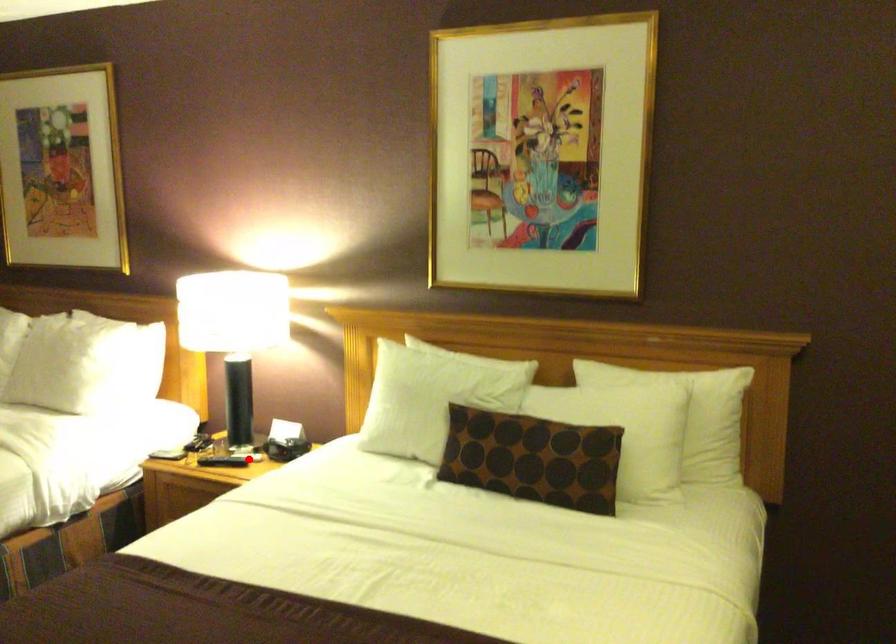
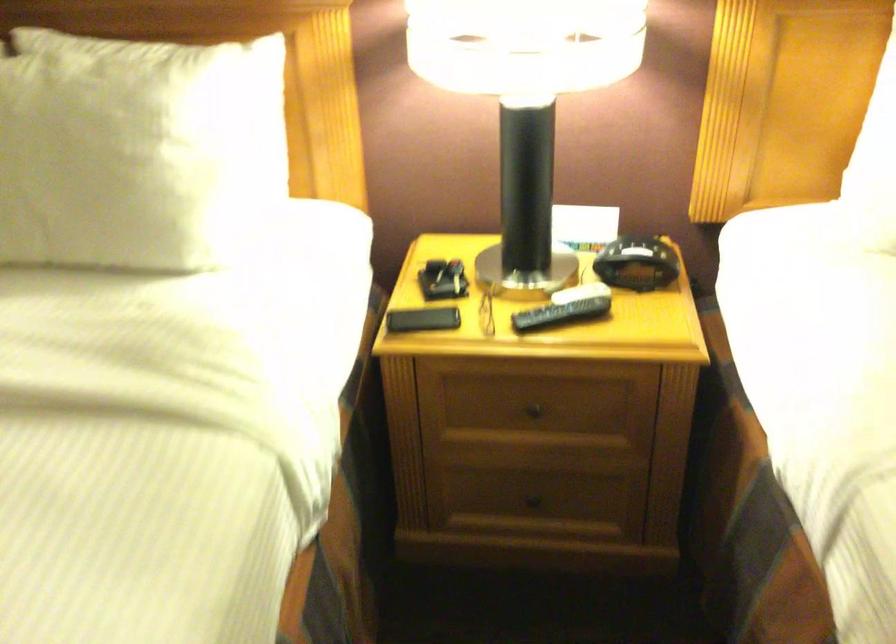
Question: I am providing you with two images of the same scene from different viewpoints. In image1, a red point is highlighted. Considering the same 3D point in image2, which of the following is correct?

Choices:
 (A) It is closer
 (B) It is farther

Answer: (A)